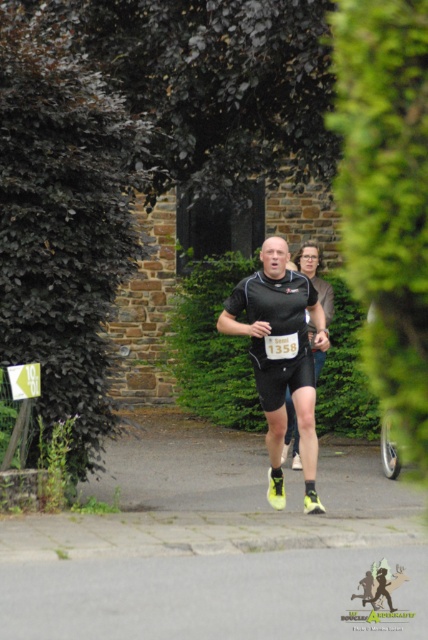
You are a photographer trying to capture a closeup of the matte black running suit at center without the green leafy hedge at center blocking the shot. Given their sizes, can you suggest a way to adjust your position or angle?

Since the green leafy hedge at center is wider than the matte black running suit at center, moving closer to the matte black running suit at center would reduce the hedge obstruction, allowing a clearer shot.

You are a runner in a race and you see the point marked at coordinates (62,221). Where is this point located?

The point marked at coordinates (62,221) is located on the dark green leafy hedge at left.

You are a runner in the race and you see two points marked on the track ahead of you. The first point is at coordinates point (219, 275) and the second point is at point (231, 332). Which point is closer to you?

Point (231, 332) is closer to you because it is in front of point (219, 275), which is behind it.